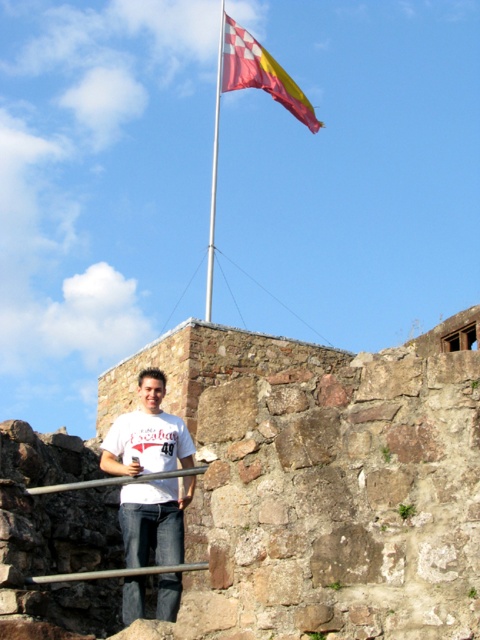
Can you confirm if red and white checkered flag at upper center is positioned to the left of white metallic flag pole at upper center?

In fact, red and white checkered flag at upper center is to the right of white metallic flag pole at upper center.

Which of these two, red and white checkered flag at upper center or white metallic flag pole at upper center, stands shorter?

Standing shorter between the two is red and white checkered flag at upper center.

This screenshot has width=480, height=640. I want to click on red and white checkered flag at upper center, so click(261, 72).

Find the location of a particular element. white matte t-shirt at center is located at coordinates (146, 433).

From the picture: Does white matte t-shirt at center appear on the left side of white metallic flag pole at upper center?

In fact, white matte t-shirt at center is to the right of white metallic flag pole at upper center.

From the picture: Who is more forward, [131,528] or [213,225]?

Point [131,528] is more forward.

This screenshot has width=480, height=640. Find the location of `white matte t-shirt at center`. white matte t-shirt at center is located at coordinates (146, 433).

Measure the distance from red and white checkered flag at upper center to silver metallic rail at lower center.

269.13 feet

Does red and white checkered flag at upper center have a greater width compared to silver metallic rail at lower center?

Correct, the width of red and white checkered flag at upper center exceeds that of silver metallic rail at lower center.

Where is `red and white checkered flag at upper center`? red and white checkered flag at upper center is located at coordinates (261, 72).